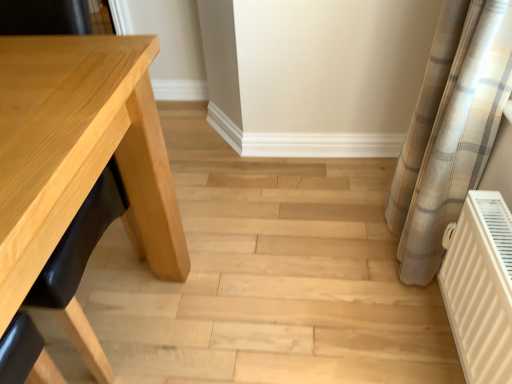
Question: Is natural wood table at left closer to camera compared to plaid fabric curtain at right?

Choices:
 (A) no
 (B) yes

Answer: (A)

Question: From a real-world perspective, is natural wood table at left positioned under plaid fabric curtain at right based on gravity?

Choices:
 (A) yes
 (B) no

Answer: (A)

Question: Is plaid fabric curtain at right at the back of natural wood table at left?

Choices:
 (A) yes
 (B) no

Answer: (B)

Question: Is plaid fabric curtain at right located within natural wood table at left?

Choices:
 (A) no
 (B) yes

Answer: (A)

Question: Is natural wood table at left to the left of plaid fabric curtain at right from the viewer's perspective?

Choices:
 (A) no
 (B) yes

Answer: (B)

Question: Considering the relative sizes of natural wood table at left and plaid fabric curtain at right in the image provided, is natural wood table at left smaller than plaid fabric curtain at right?

Choices:
 (A) yes
 (B) no

Answer: (B)

Question: Is plaid fabric curtain at right wider than white matte radiator at lower right?

Choices:
 (A) no
 (B) yes

Answer: (B)

Question: Is plaid fabric curtain at right positioned far away from white matte radiator at lower right?

Choices:
 (A) yes
 (B) no

Answer: (B)

Question: Is plaid fabric curtain at right oriented towards white matte radiator at lower right?

Choices:
 (A) no
 (B) yes

Answer: (A)

Question: Is white matte radiator at lower right located within plaid fabric curtain at right?

Choices:
 (A) no
 (B) yes

Answer: (A)

Question: Is plaid fabric curtain at right smaller than white matte radiator at lower right?

Choices:
 (A) no
 (B) yes

Answer: (A)

Question: From a real-world perspective, is plaid fabric curtain at right positioned under white matte radiator at lower right based on gravity?

Choices:
 (A) yes
 (B) no

Answer: (B)

Question: Is plaid fabric curtain at right further to camera compared to natural wood table at left?

Choices:
 (A) yes
 (B) no

Answer: (B)